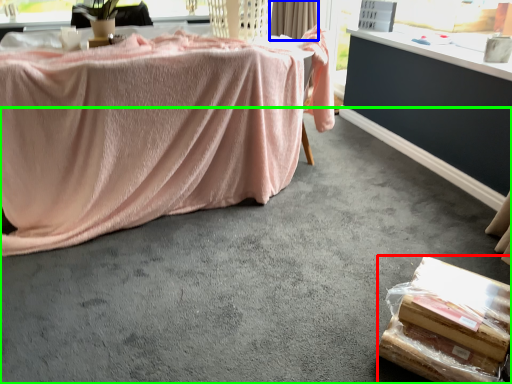
Question: Which object is the farthest from food (highlighted by a red box)? Choose among these: curtain (highlighted by a blue box) or concrete (highlighted by a green box).

Choices:
 (A) curtain
 (B) concrete

Answer: (A)